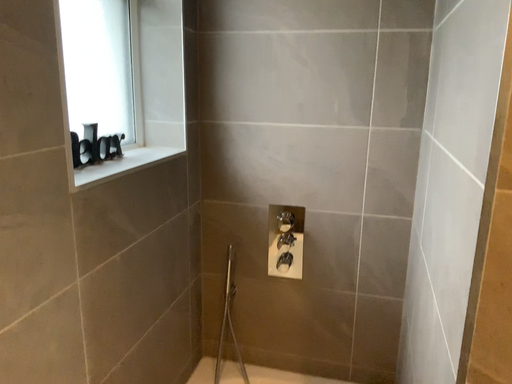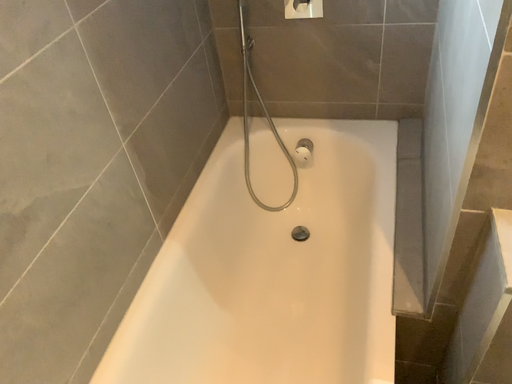
Question: Which way did the camera rotate in the video?

Choices:
 (A) rotated downward
 (B) rotated upward

Answer: (A)